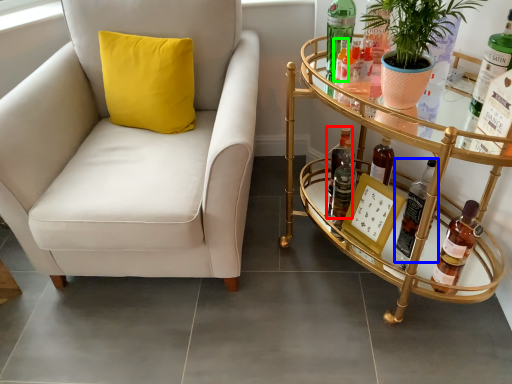
Question: Based on their relative distances, which object is farther from beer bottle (highlighted by a red box)? Choose from bottle (highlighted by a blue box) and bottle (highlighted by a green box).

Choices:
 (A) bottle
 (B) bottle

Answer: (B)